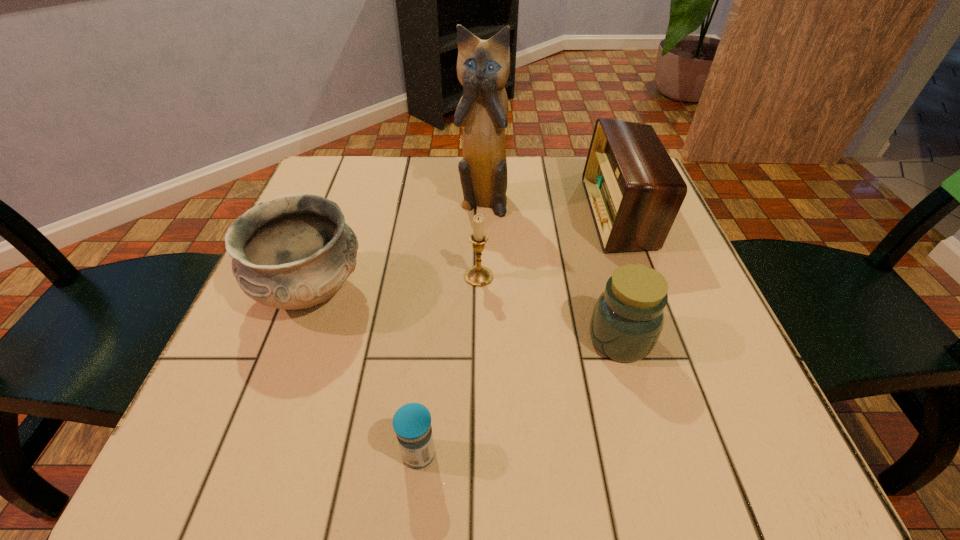
Find the location of a particular element. This screenshot has height=540, width=960. cat is located at coordinates (483, 66).

Image resolution: width=960 pixels, height=540 pixels. I want to click on radio receiver, so click(x=634, y=190).

Where is `the leftmost object`? Image resolution: width=960 pixels, height=540 pixels. the leftmost object is located at coordinates (295, 251).

Locate an element on the screen. candle holder is located at coordinates [x=479, y=276].

Find the location of `jar`. jar is located at coordinates (628, 317).

The height and width of the screenshot is (540, 960). I want to click on medicine, so click(x=412, y=422).

Where is `the nearest object`? This screenshot has height=540, width=960. the nearest object is located at coordinates (412, 422).

Find the location of a particular element. The height and width of the screenshot is (540, 960). vacant region located 0.200m on the face of the cat is located at coordinates (483, 281).

Identify the location of free space located on the front-facing side of the radio receiver. (459, 214).

This screenshot has width=960, height=540. I want to click on free space located 0.120m on the front-facing side of the radio receiver, so click(538, 214).